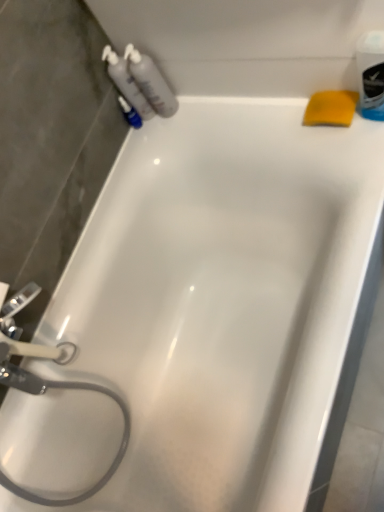
I want to click on vacant space to the left of translucent plastic bottles at upper left, acting as the second cleaning product starting from the left, so click(x=146, y=144).